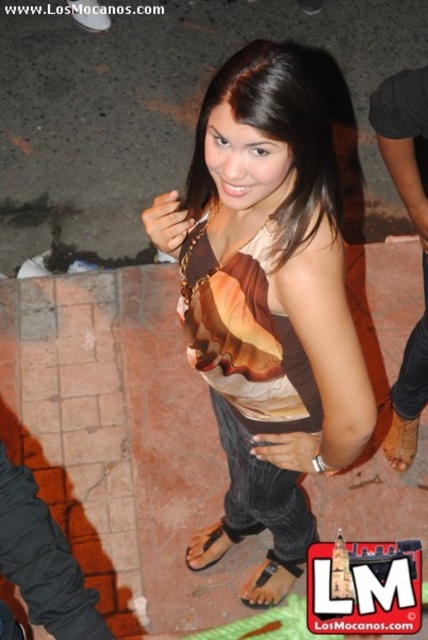
Question: Which object is positioned farthest from the black leather sandal at lower center?

Choices:
 (A) matte brown tank top at center
 (B) brown leather sandal at lower right
 (C) brown fabric dress at center
 (D) brown leather shoes at right

Answer: (C)

Question: Based on their relative distances, which object is farther from the brown fabric dress at center?

Choices:
 (A) brown leather sandal at lower right
 (B) matte brown tank top at center
 (C) black leather sandal at lower center
 (D) black fabric sandal at lower center

Answer: (C)

Question: Does matte brown tank top at center have a larger size compared to brown fabric dress at center?

Choices:
 (A) yes
 (B) no

Answer: (A)

Question: Which object is positioned closest to the brown fabric dress at center?

Choices:
 (A) brown leather sandal at lower right
 (B) black fabric sandal at lower center
 (C) black leather sandal at lower center

Answer: (A)

Question: Can you confirm if matte brown tank top at center is thinner than brown leather shoes at right?

Choices:
 (A) no
 (B) yes

Answer: (A)

Question: Is brown leather shoes at right positioned in front of black leather sandal at lower center?

Choices:
 (A) yes
 (B) no

Answer: (A)